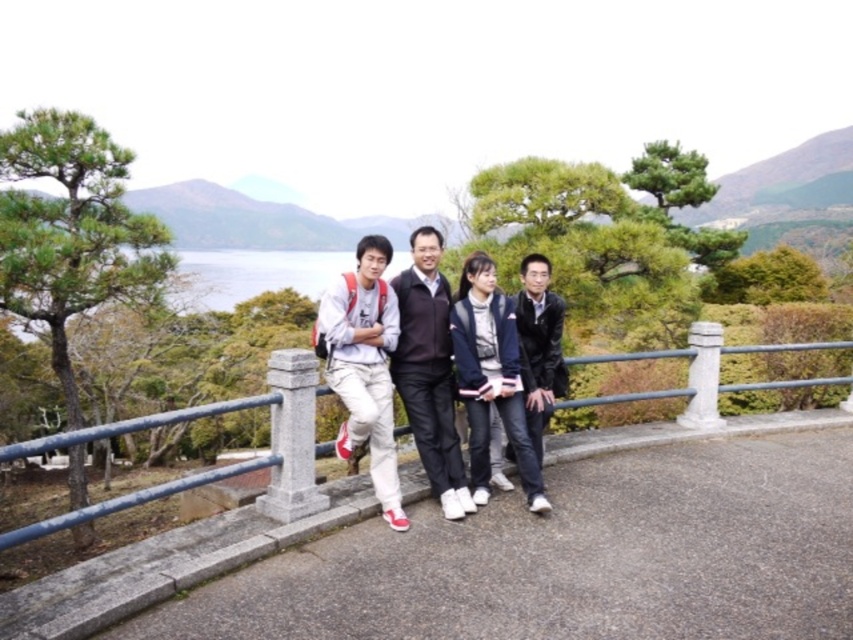
Question: Where is light gray cotton pants at center located in relation to transparent water at center in the image?

Choices:
 (A) below
 (B) above

Answer: (A)

Question: Does light gray cotton pants at center appear on the right side of dark brown leather jacket at center?

Choices:
 (A) no
 (B) yes

Answer: (A)

Question: Which point appears farthest from the camera in this image?

Choices:
 (A) (426, 392)
 (B) (540, 400)

Answer: (B)

Question: Considering the relative positions of light gray cotton pants at center and black leather jacket at right in the image provided, where is light gray cotton pants at center located with respect to black leather jacket at right?

Choices:
 (A) below
 (B) above

Answer: (B)

Question: Which point is closer to the camera?

Choices:
 (A) dark brown leather jacket at center
 (B) black leather jacket at right
 (C) light gray cotton pants at center

Answer: (A)

Question: Estimate the real-world distances between objects in this image. Which object is farther from the light gray cotton pants at center?

Choices:
 (A) dark brown leather jacket at center
 (B) transparent water at center
 (C) black leather jacket at right

Answer: (B)